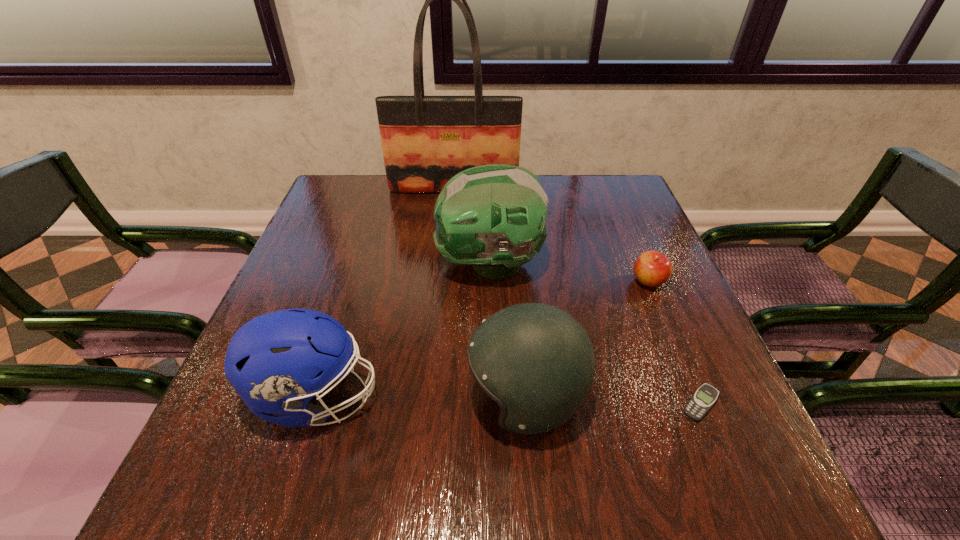
Locate an element on the screen. The width and height of the screenshot is (960, 540). vacant space at the left edge of the desktop is located at coordinates (315, 228).

Identify the location of vacant space at the right edge of the desktop. (684, 420).

Find the location of a particular element. free space at the far right corner of the desktop is located at coordinates (588, 174).

At what (x,y) coordinates should I click in order to perform the action: click on free space at the near right corner. Please return your answer as a coordinate pair (x, y). The width and height of the screenshot is (960, 540). Looking at the image, I should click on click(x=720, y=505).

I want to click on empty space between the farthest object and the beeper, so click(577, 296).

Where is `vacant region between the shortest object and the apple`? This screenshot has width=960, height=540. vacant region between the shortest object and the apple is located at coordinates (675, 342).

Find the location of a particular element. Image resolution: width=960 pixels, height=540 pixels. unoccupied area between the tallest football helmet and the leftmost football helmet is located at coordinates (402, 330).

You are a GUI agent. You are given a task and a screenshot of the screen. Output one action in this format:
    pyautogui.click(x=<x>, y=<y>)
    Task: Click on the fifth closest object to the fifth tallest object
    
    Given the screenshot: What is the action you would take?
    pyautogui.click(x=273, y=361)

Locate an element on the screen. This screenshot has width=960, height=540. the second closest object relative to the tallest object is located at coordinates (652, 268).

Find the location of `football helmet that is the second closest to the farthest object`. football helmet that is the second closest to the farthest object is located at coordinates (535, 360).